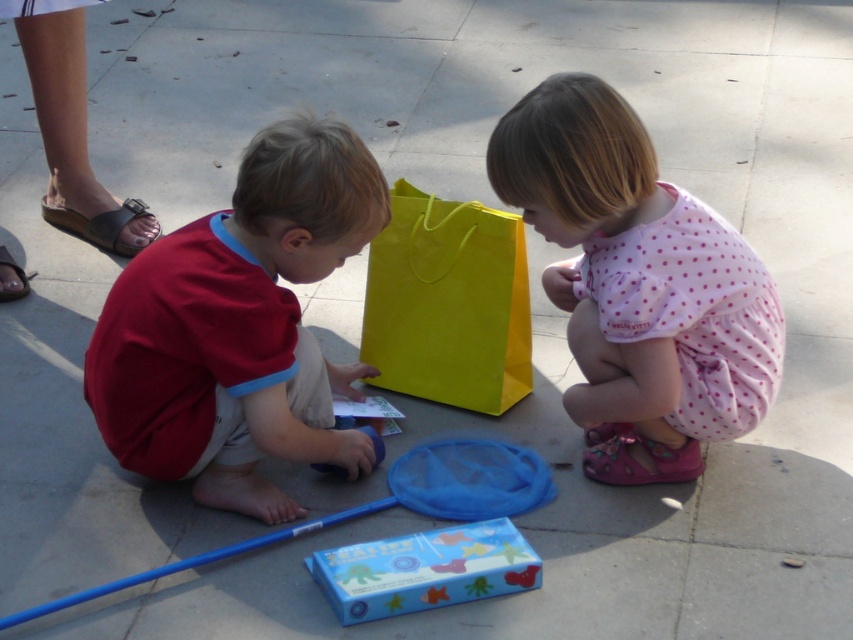
You are a photographer positioned at the center of the scene. You want to take a photo that includes both the matte red shirt at left and the pink polka dot dress at right. Which object should be placed closer to the camera to ensure both are in focus?

The matte red shirt at left is located at point (239, 326), so you should place the matte red shirt at left closer to the camera to ensure both are in focus.

You are a photographer trying to capture a candid shot of the children playing. You notice the pink dotted fabric at lower right and the yellow paper bag at center. Which object should you focus on first if you want to capture the one closer to the ground?

The yellow paper bag at center is closer to the ground since the pink dotted fabric at lower right is above it.

Based on the scene description, where exactly is the yellow paper bag at center located in terms of coordinates?

The yellow paper bag at center is located at coordinates point (x=448, y=304).